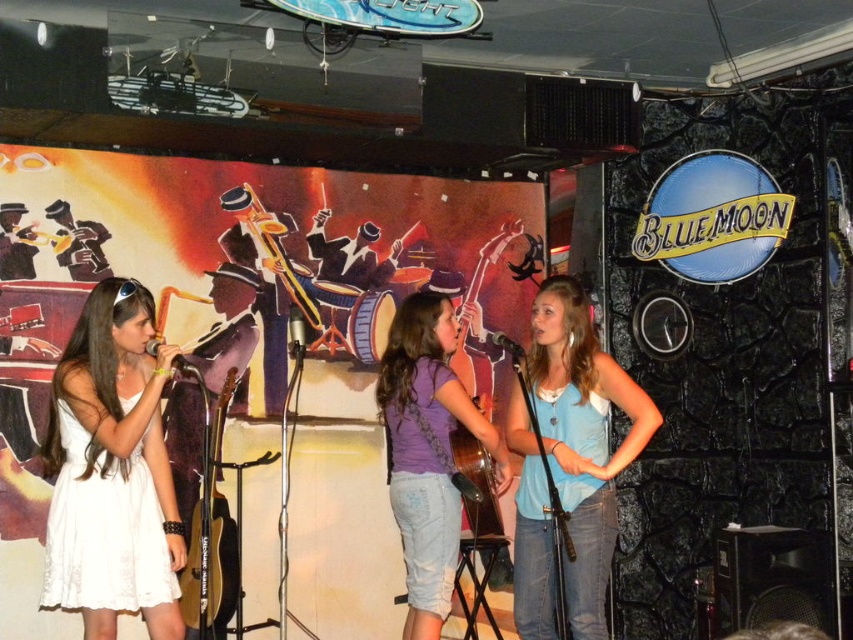
Question: Can you confirm if purple denim shorts at center is positioned below matte black microphone at center?

Choices:
 (A) no
 (B) yes

Answer: (B)

Question: Is blue cotton tank top at center behind metallic silver microphone at center?

Choices:
 (A) no
 (B) yes

Answer: (A)

Question: Estimate the real-world distances between objects in this image. Which object is farther from the blue cotton tank top at center?

Choices:
 (A) matte black microphone at center
 (B) gold metallic guitar at center

Answer: (B)

Question: Does white lace dress at left come in front of purple denim shorts at center?

Choices:
 (A) no
 (B) yes

Answer: (B)

Question: Which point is farther to the camera?

Choices:
 (A) (289, 332)
 (B) (519, 353)

Answer: (A)

Question: Which point is farther to the camera?

Choices:
 (A) (181, 371)
 (B) (297, 328)

Answer: (B)